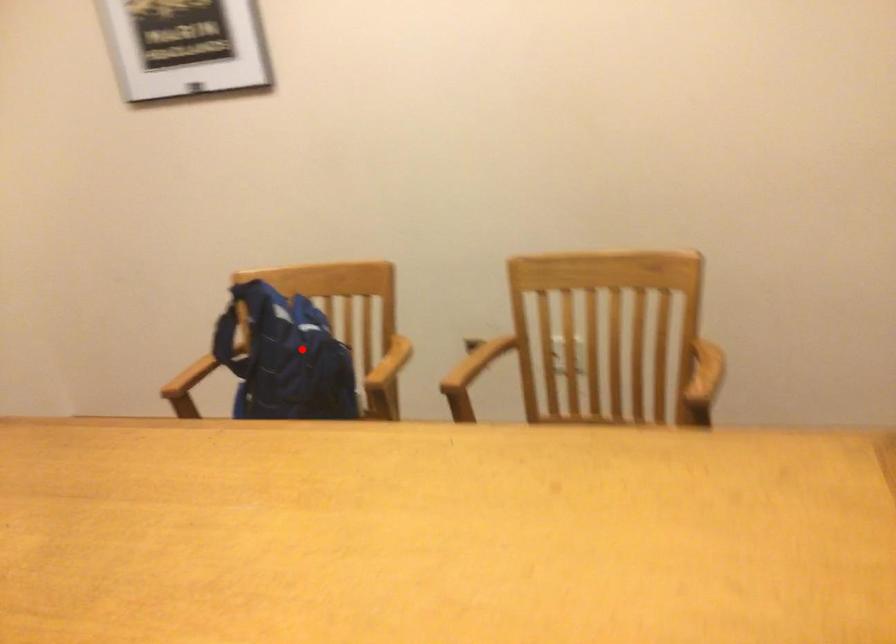
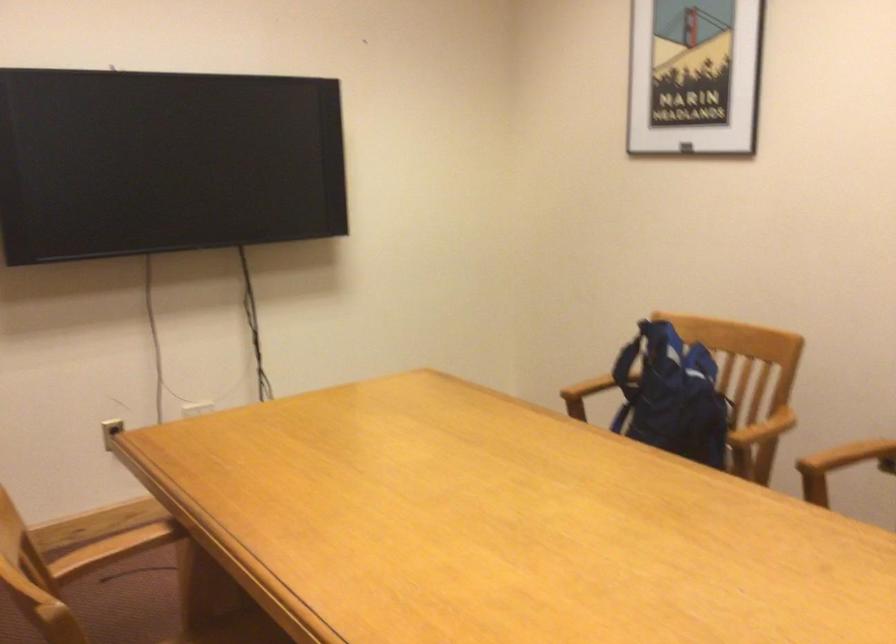
Where in the second image is the point corresponding to the highlighted location from the first image?

(672, 395)